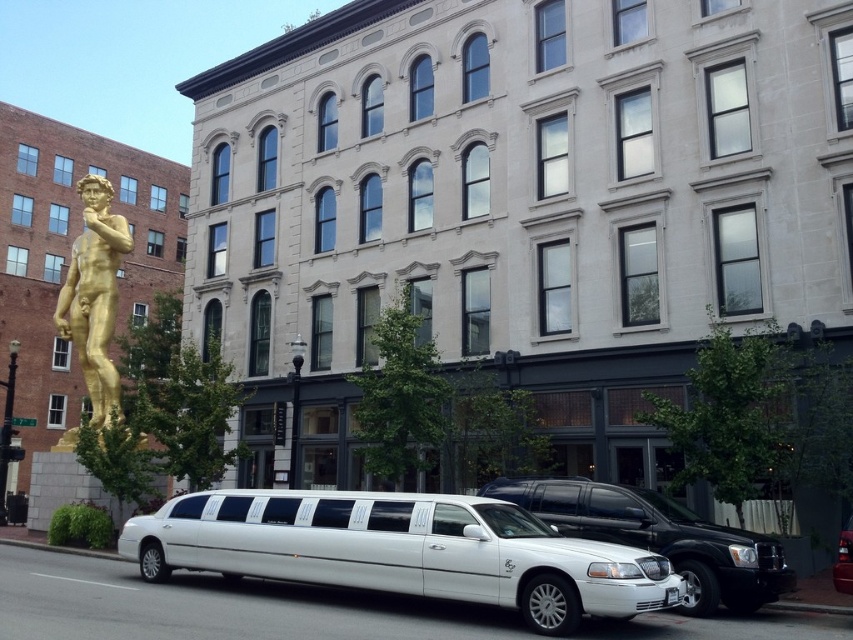
Question: Among these objects, which one is farthest from the camera?

Choices:
 (A) gold polished statue at left
 (B) white metallic limousine at center

Answer: (A)

Question: Is white glossy limousine at lower center below white glossy limousine at center?

Choices:
 (A) yes
 (B) no

Answer: (A)

Question: Considering the relative positions of gold polished statue at left and white metallic limousine at center in the image provided, where is gold polished statue at left located with respect to white metallic limousine at center?

Choices:
 (A) above
 (B) below

Answer: (A)

Question: Among these objects, which one is farthest from the camera?

Choices:
 (A) gold polished statue at left
 (B) white metallic limousine at center
 (C) white glossy limousine at lower center

Answer: (A)

Question: Which of the following is the closest to the observer?

Choices:
 (A) gold polished statue at left
 (B) white metallic limousine at center
 (C) white glossy limousine at lower center

Answer: (C)

Question: Is white glossy limousine at lower center above white glossy limousine at center?

Choices:
 (A) yes
 (B) no

Answer: (B)